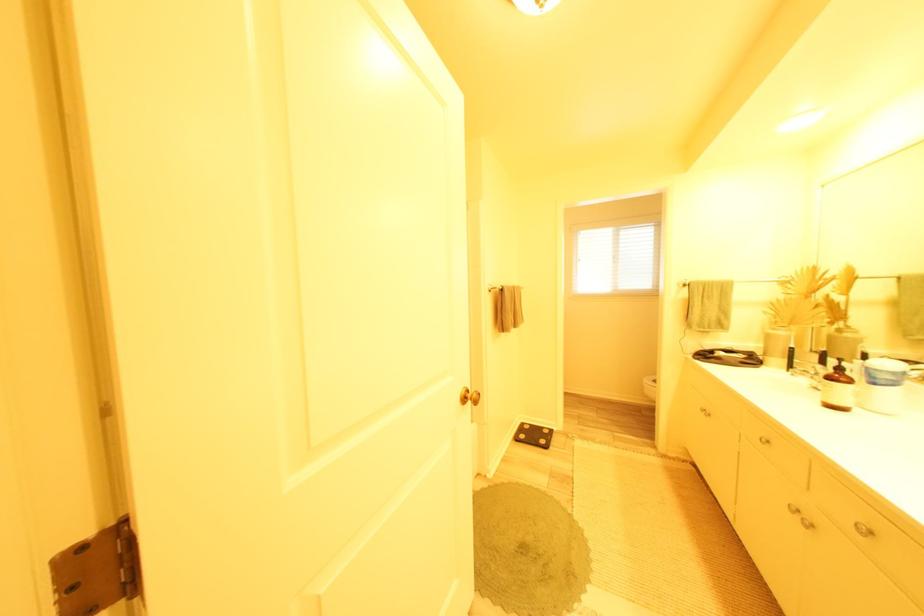
Where is `gold door knob`? Image resolution: width=924 pixels, height=616 pixels. gold door knob is located at coordinates (468, 397).